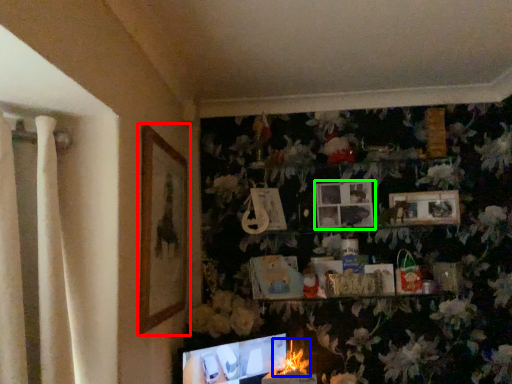
Question: Which object is the closest to the picture frame (highlighted by a red box)? Choose among these: flower (highlighted by a blue box) or picture frame (highlighted by a green box).

Choices:
 (A) flower
 (B) picture frame

Answer: (A)